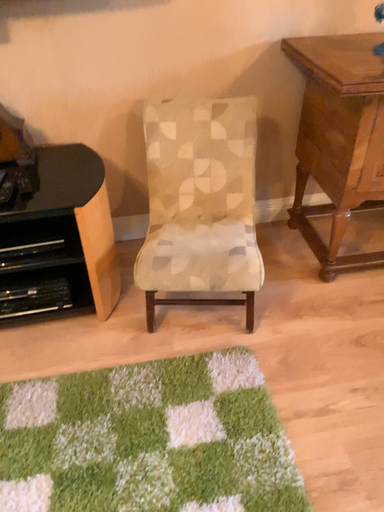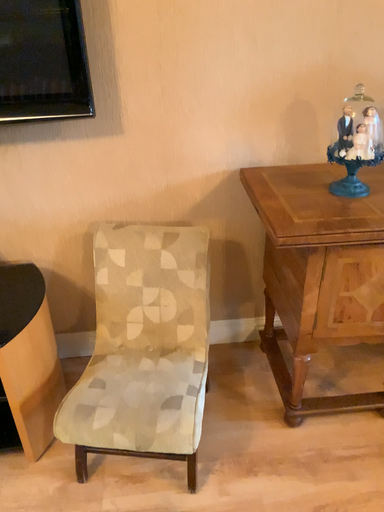
Question: How did the camera likely rotate when shooting the video?

Choices:
 (A) rotated upward
 (B) rotated downward

Answer: (A)